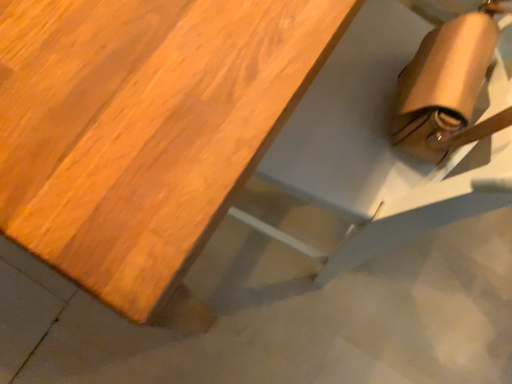
I want to click on vacant area that is in front of matte brown bag at lower right, so click(x=276, y=337).